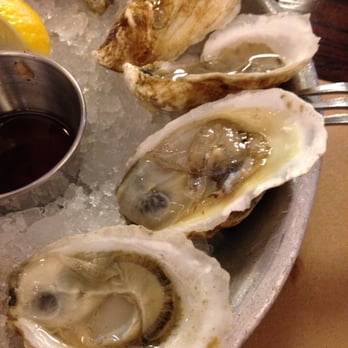
I want to click on small silver bowl, so click(61, 88).